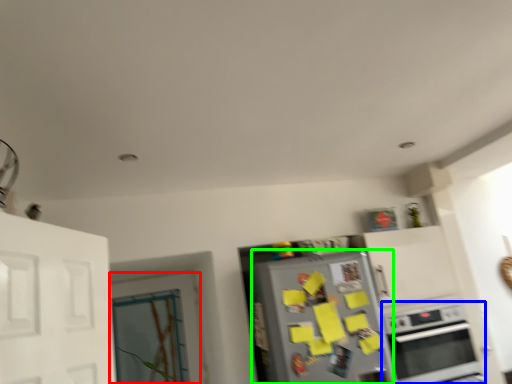
Question: Considering the real-world distances, which object is closest to door (highlighted by a red box)? oven (highlighted by a blue box) or refrigerator (highlighted by a green box).

Choices:
 (A) oven
 (B) refrigerator

Answer: (B)